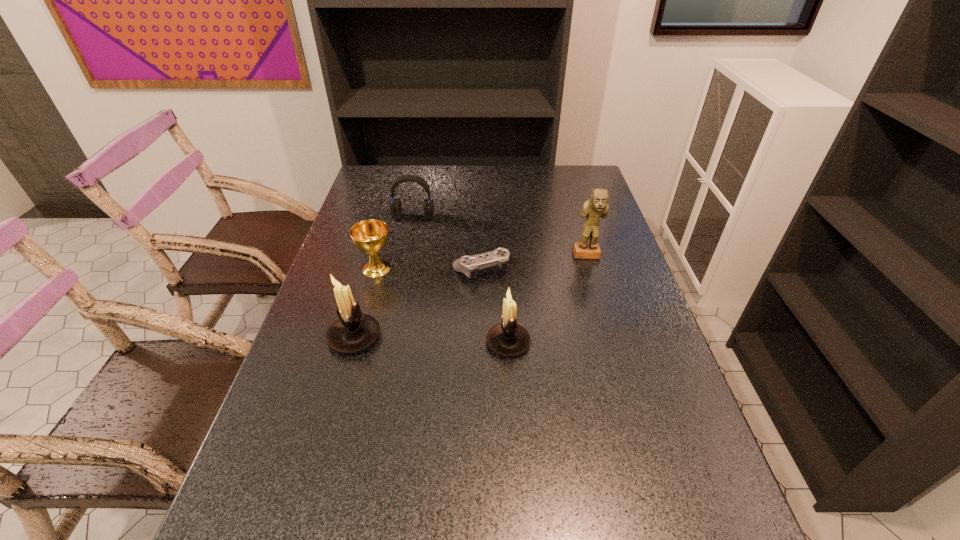
In order to click on free space at the far left corner of the desktop in this screenshot , I will do `click(395, 178)`.

The width and height of the screenshot is (960, 540). What are the coordinates of `vacant space at the near left corner of the desktop` in the screenshot? It's located at (280, 503).

The height and width of the screenshot is (540, 960). I want to click on free space at the far right corner of the desktop, so click(567, 172).

This screenshot has width=960, height=540. Find the location of `free space between the shorter candle holder and the control`. free space between the shorter candle holder and the control is located at coordinates (494, 306).

What are the coordinates of `free space that is in between the chalice and the right candle holder` in the screenshot? It's located at (443, 306).

You are a GUI agent. You are given a task and a screenshot of the screen. Output one action in this format:
    pyautogui.click(x=<x>, y=<y>)
    Task: Click on the free area in between the figurine and the left candle holder
    The height and width of the screenshot is (540, 960).
    Given the screenshot: What is the action you would take?
    pyautogui.click(x=470, y=296)

Find the location of a particular element. The width and height of the screenshot is (960, 540). free spot between the chalice and the left candle holder is located at coordinates (x=366, y=303).

The height and width of the screenshot is (540, 960). Identify the location of free space that is in between the shortest object and the chalice. (428, 269).

The image size is (960, 540). What are the coordinates of `unoccupied area between the control and the figurine` in the screenshot? It's located at (534, 262).

Image resolution: width=960 pixels, height=540 pixels. I want to click on free point between the chalice and the taller candle holder, so [x=366, y=303].